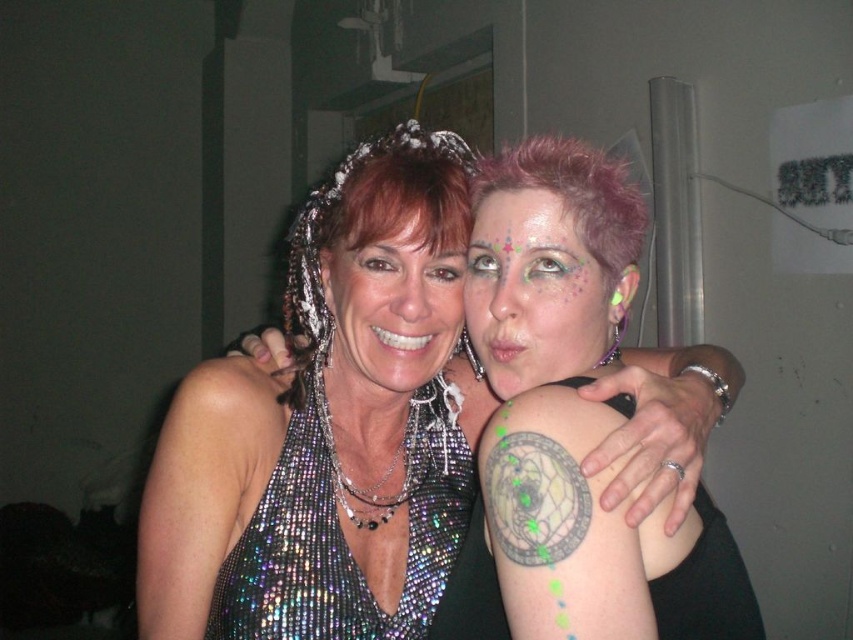
You are a photographer at a party and need to capture a closeup shot of the gray ink tattoo at shoulder without including the shiny sequined dress at center in the frame. Is this possible given their sizes?

The shiny sequined dress at center has a larger size compared to gray ink tattoo at shoulder, so it might be challenging to frame the tattoo without including the dress due to the dress being bigger.

You are at a party and want to take a photo of the shiny sequined dress at center. Where should you aim your camera to capture it?

You should aim your camera at point 0.462 on the vertical axis and 0.478 on the horizontal axis to capture the shiny sequined dress at center.

From the picture: You are a photographer at a party and need to capture a closeup of both the shiny sequined dress at center and the gray ink tattoo at shoulder. Since the camera can only focus on one subject at a time, which one should you choose to ensure the other is still in the frame?

The shiny sequined dress at center is positioned on the left side of gray ink tattoo at shoulder, so you should focus on the gray ink tattoo at shoulder to keep the shiny sequined dress at center in the frame on its left side.